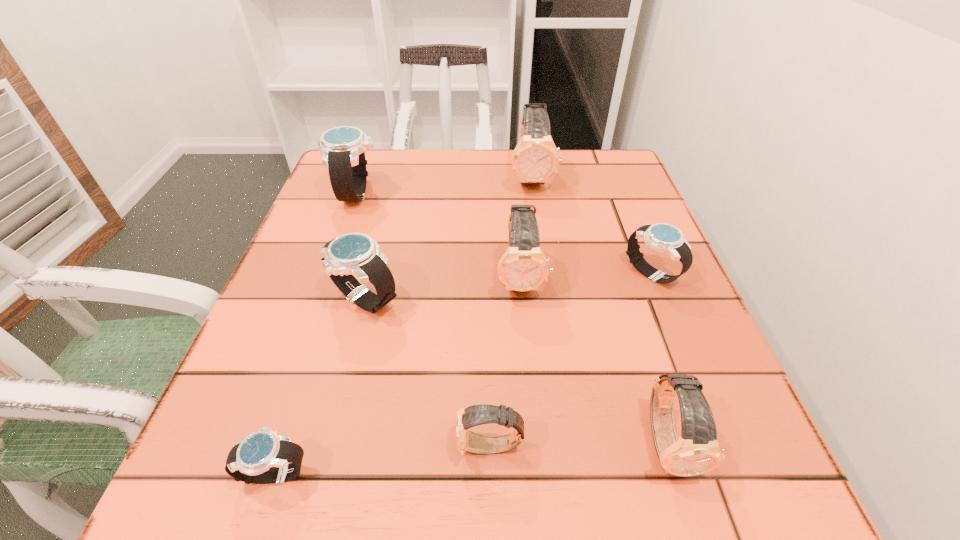
Find the location of a particular element. vacant area between the second biggest silver watch and the biggest gold watch is located at coordinates (447, 238).

Find the location of a particular element. The width and height of the screenshot is (960, 540). empty space that is in between the farthest silver watch and the smallest gold watch is located at coordinates (424, 320).

I want to click on free spot between the rightmost silver watch and the smallest gold watch, so click(571, 360).

Where is `free spot between the farthest silver watch and the rightmost gold watch`? free spot between the farthest silver watch and the rightmost gold watch is located at coordinates (513, 318).

You are a GUI agent. You are given a task and a screenshot of the screen. Output one action in this format:
    pyautogui.click(x=<x>, y=<y>)
    Task: Click on the free space between the tallest object and the smallest gold watch
    This screenshot has height=540, width=960.
    Given the screenshot: What is the action you would take?
    pyautogui.click(x=511, y=312)

What are the coordinates of `vacant point located between the biggest silver watch and the nearest silver watch` in the screenshot? It's located at (317, 333).

Locate which object is the sixth closest to the farthest silver watch. Please provide its 2D coordinates. Your answer should be formatted as a tuple, i.e. [(x, y)], where the tuple contains the x and y coordinates of a point satisfying the conditions above.

[(466, 441)]

Select which object appears as the closest to the tallest watch. Please provide its 2D coordinates. Your answer should be formatted as a tuple, i.e. [(x, y)], where the tuple contains the x and y coordinates of a point satisfying the conditions above.

[(523, 267)]

Locate an element on the screen. the sixth closest watch to the farthest silver watch is located at coordinates (466, 441).

The image size is (960, 540). I want to click on watch identified as the second closest to the smallest gold watch, so click(263, 457).